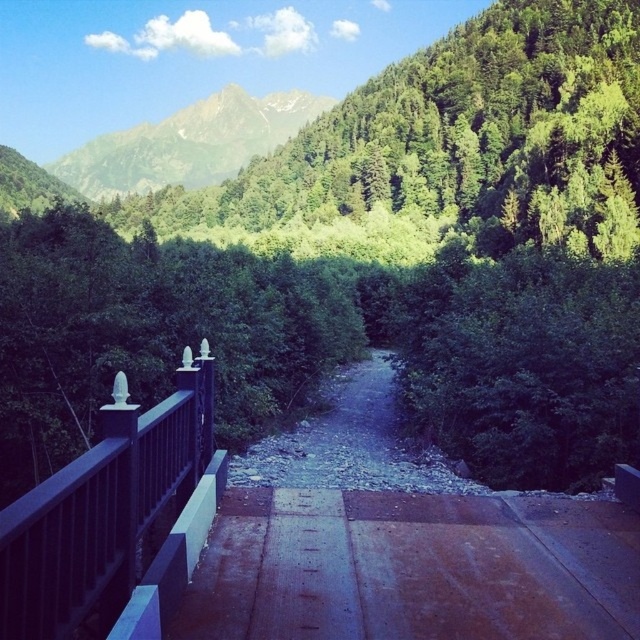
Question: Which object appears farthest from the camera in this image?

Choices:
 (A) green textured mountain at upper center
 (B) black matte railing at left
 (C) rustic wooden path at center

Answer: (A)

Question: Estimate the real-world distances between objects in this image. Which object is closer to the green textured mountain at upper center?

Choices:
 (A) rustic wooden path at center
 (B) black matte railing at left

Answer: (A)

Question: Considering the relative positions of rustic wooden path at center and green textured mountain at upper center in the image provided, where is rustic wooden path at center located with respect to green textured mountain at upper center?

Choices:
 (A) above
 (B) below

Answer: (B)

Question: Is the position of rustic wooden path at center less distant than that of green textured mountain at upper center?

Choices:
 (A) yes
 (B) no

Answer: (A)

Question: Among these points, which one is farthest from the camera?

Choices:
 (A) (211, 120)
 (B) (554, 529)

Answer: (A)

Question: Does rustic wooden path at center come in front of green textured mountain at upper center?

Choices:
 (A) yes
 (B) no

Answer: (A)